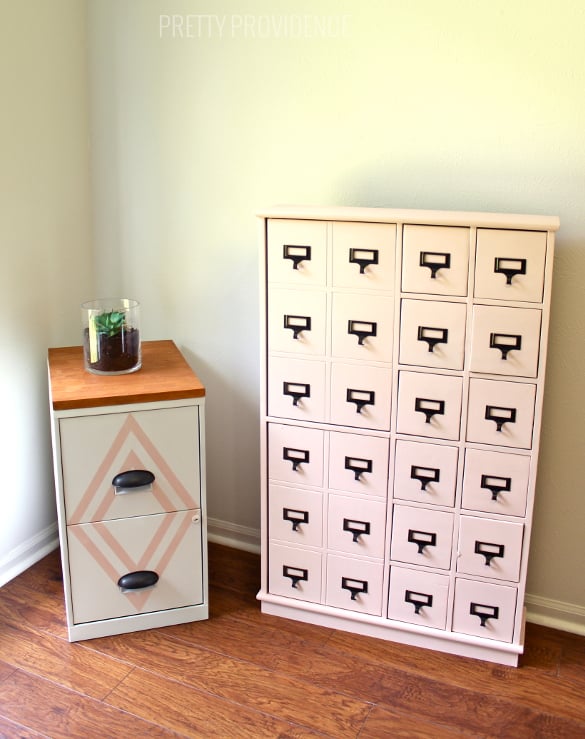
This screenshot has height=739, width=585. Find the location of `wood floor`. wood floor is located at coordinates (191, 701).